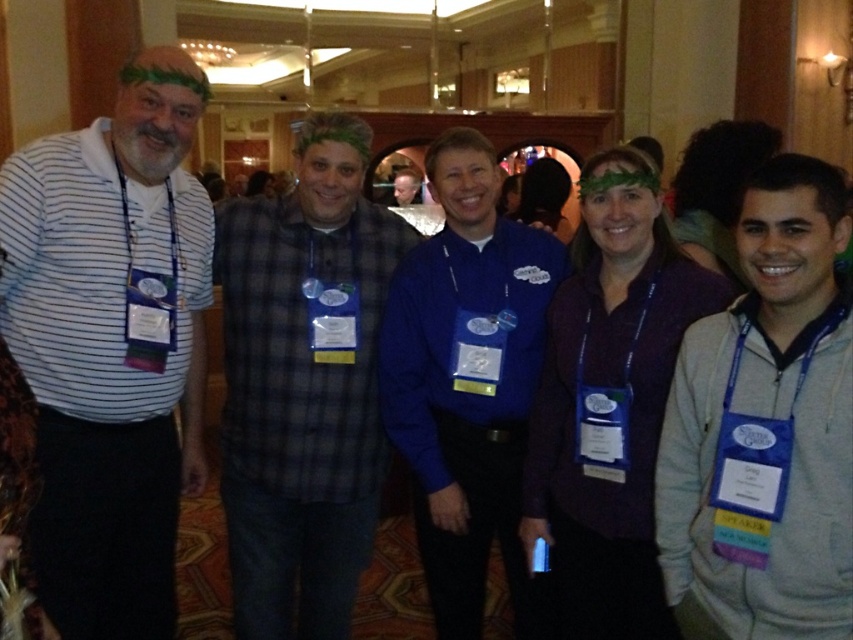
You are organizing a photo shoot and need to arrange the plaid shirt at center and the blue fabric shirt at center in a line. Which one should you place first if you want to follow the order from tallest to shortest?

The plaid shirt at center is much taller than the blue fabric shirt at center, so you should place the plaid shirt at center first in the order from tallest to shortest.

You are organizing a photo shoot and need to arrange the gray fleece hoodie at right and the matte blue shirt at center so that they are side by side without overlapping. Based on their current positions and sizes, which one should be placed on the left to ensure they fit properly?

The gray fleece hoodie at right might be wider than the matte blue shirt at center, so placing the wider gray fleece hoodie at right on the left side would allow both to fit side by side without overlapping.